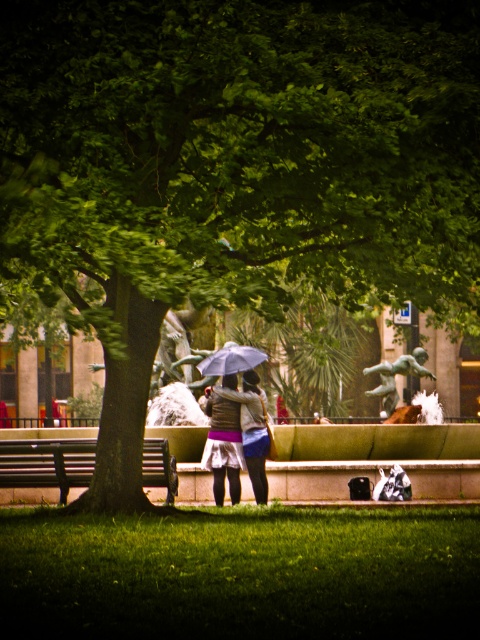
Question: Is wooden bench at left further to camera compared to purple matte umbrella at center?

Choices:
 (A) yes
 (B) no

Answer: (B)

Question: Which object is positioned farthest from the purple matte umbrella at center?

Choices:
 (A) green grass at lower center
 (B) green patinated bronze statue at center
 (C) matte brown jacket at center

Answer: (A)

Question: Is matte brown jacket at center smaller than green patinated bronze statue at center?

Choices:
 (A) yes
 (B) no

Answer: (A)

Question: Among these points, which one is nearest to the camera?

Choices:
 (A) (228, 397)
 (B) (424, 360)
 (C) (223, 353)
 (D) (34, 456)

Answer: (D)

Question: Which object appears farthest from the camera in this image?

Choices:
 (A) green patinated bronze statue at center
 (B) green grass at lower center
 (C) purple matte umbrella at center
 (D) wooden bench at left

Answer: (A)

Question: Can you confirm if green grass at lower center is positioned to the right of purple matte umbrella at center?

Choices:
 (A) yes
 (B) no

Answer: (A)